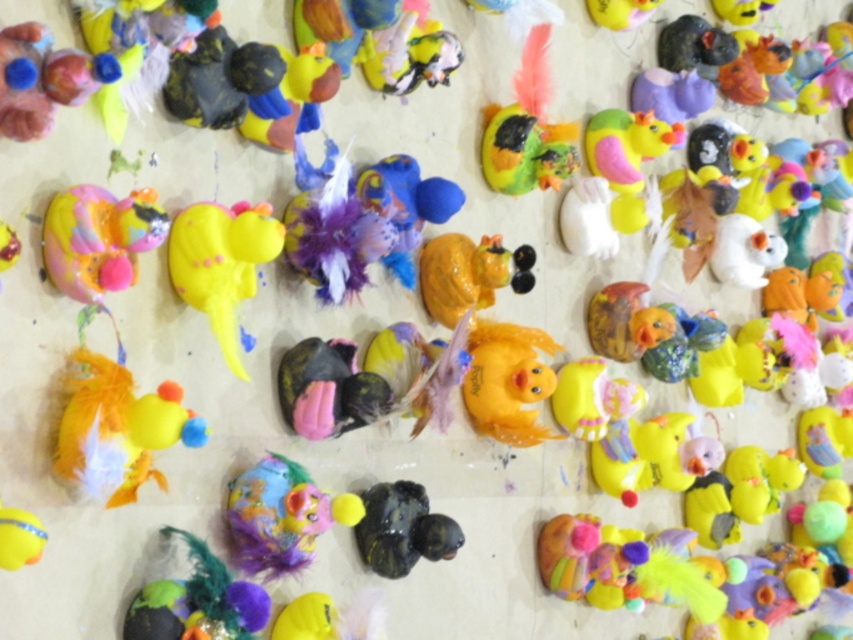
Question: Among these points, which one is farthest from the camera?

Choices:
 (A) (436, 301)
 (B) (190, 442)
 (C) (225, 273)
 (D) (253, 563)

Answer: (A)

Question: Is matte yellow duckling at lower left below multicolored clay duckling at center?

Choices:
 (A) yes
 (B) no

Answer: (B)

Question: Is yellow matte rubber duck at center smaller than multicolored clay duckling at center?

Choices:
 (A) no
 (B) yes

Answer: (A)

Question: Among these objects, which one is farthest from the camera?

Choices:
 (A) multicolored clay duckling at center
 (B) shiny black duck at center
 (C) matte orange rubber duck at center

Answer: (C)

Question: Does matte yellow duckling at lower left lie behind yellow matte rubber duck at center?

Choices:
 (A) no
 (B) yes

Answer: (A)

Question: Among these points, which one is nearest to the camera?

Choices:
 (A) (415, 556)
 (B) (78, 81)
 (C) (305, 516)
 (D) (148, 413)

Answer: (B)